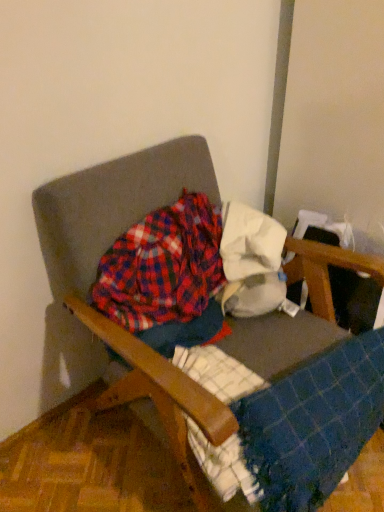
Question: Should I look upward or downward to see wooden armchair at center?

Choices:
 (A) down
 (B) up

Answer: (A)

Question: Is white cotton cloth at upper right looking in the opposite direction of blue checkered blanket at lower right?

Choices:
 (A) yes
 (B) no

Answer: (B)

Question: From the image's perspective, would you say white cotton cloth at upper right is shown under blue checkered blanket at lower right?

Choices:
 (A) yes
 (B) no

Answer: (B)

Question: From the image's perspective, is white cotton cloth at upper right on top of blue checkered blanket at lower right?

Choices:
 (A) yes
 (B) no

Answer: (A)

Question: Does white cotton cloth at upper right turn towards blue checkered blanket at lower right?

Choices:
 (A) yes
 (B) no

Answer: (B)

Question: Considering the relative positions of white cotton cloth at upper right and blue checkered blanket at lower right in the image provided, is white cotton cloth at upper right to the right of blue checkered blanket at lower right from the viewer's perspective?

Choices:
 (A) yes
 (B) no

Answer: (B)

Question: Can you confirm if white cotton cloth at upper right is smaller than blue checkered blanket at lower right?

Choices:
 (A) yes
 (B) no

Answer: (A)

Question: Is wooden armchair at center not near blue checkered blanket at lower right?

Choices:
 (A) no
 (B) yes

Answer: (A)

Question: Considering the relative sizes of wooden armchair at center and blue checkered blanket at lower right in the image provided, is wooden armchair at center taller than blue checkered blanket at lower right?

Choices:
 (A) yes
 (B) no

Answer: (A)

Question: Can we say wooden armchair at center lies outside blue checkered blanket at lower right?

Choices:
 (A) yes
 (B) no

Answer: (A)

Question: Can you confirm if wooden armchair at center is wider than blue checkered blanket at lower right?

Choices:
 (A) no
 (B) yes

Answer: (B)

Question: Is the position of wooden armchair at center less distant than that of blue checkered blanket at lower right?

Choices:
 (A) yes
 (B) no

Answer: (A)

Question: From the image's perspective, is wooden armchair at center on top of blue checkered blanket at lower right?

Choices:
 (A) yes
 (B) no

Answer: (A)

Question: Is blue checkered blanket at lower right wider than wooden armchair at center?

Choices:
 (A) yes
 (B) no

Answer: (B)